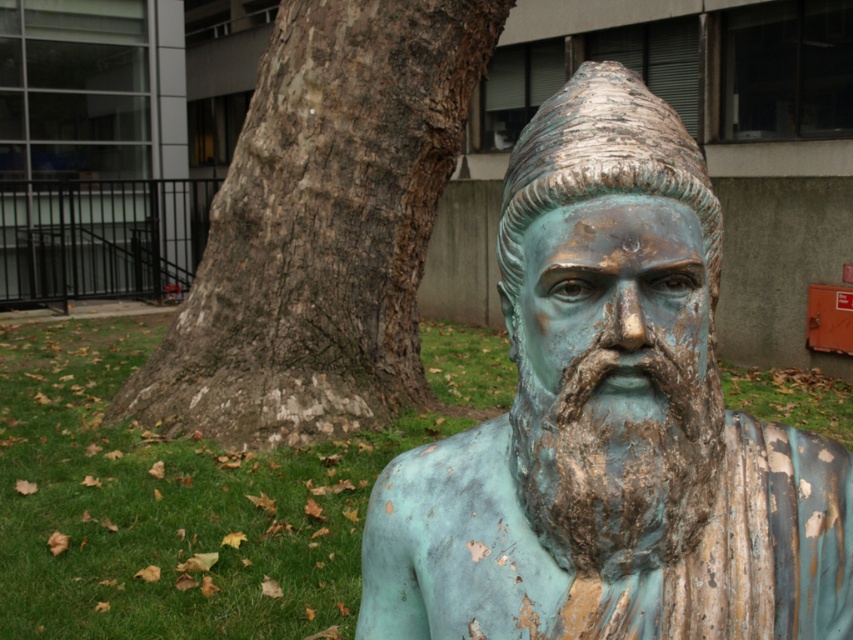
Question: Considering the relative positions of green patina bronze bust at center and brown textured bark at center in the image provided, where is green patina bronze bust at center located with respect to brown textured bark at center?

Choices:
 (A) left
 (B) right

Answer: (B)

Question: Can you confirm if brown textured bark at center is positioned to the right of green grass at lower left?

Choices:
 (A) yes
 (B) no

Answer: (B)

Question: Among these objects, which one is nearest to the camera?

Choices:
 (A) green patina bronze bust at center
 (B) green grass at lower left

Answer: (A)

Question: Is green patina bronze bust at center to the right of brown textured bark at center from the viewer's perspective?

Choices:
 (A) yes
 (B) no

Answer: (A)

Question: Which object is farther from the camera taking this photo?

Choices:
 (A) green patina beard at center
 (B) green patina bronze bust at center

Answer: (A)

Question: Which of the following is the farthest from the observer?

Choices:
 (A) [x=637, y=497]
 (B) [x=85, y=376]

Answer: (B)